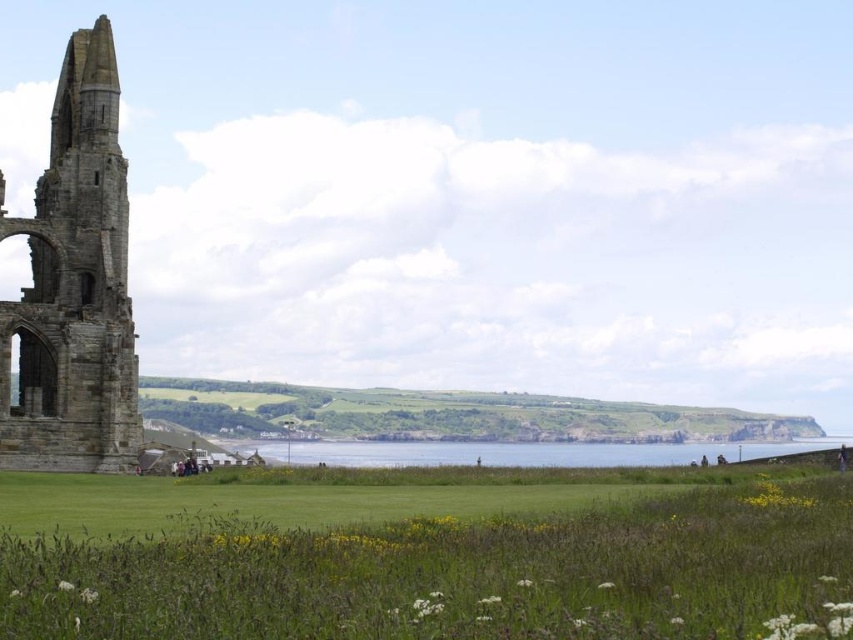
You are a photographer planning to capture the stone tower at left and the clear blue water at center in a single frame. Based on the scene, which object should you focus on first to ensure both are in the shot?

The stone tower at left is larger in size than the clear blue water at center, so you should focus on the stone tower at left first to ensure both are in the shot.

You are standing in the coastal landscape scene and want to walk from the ancient stone structure to the wildflower field. Which point, point (699, 598) or point (70, 442), would you reach first?

You would reach point (699, 598) first because it is closer to the viewer than point (70, 442).